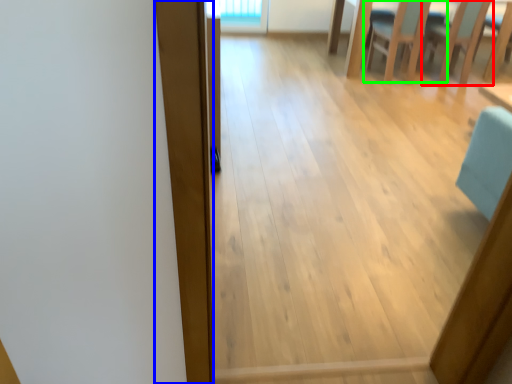
Question: Based on their relative distances, which object is farther from armchair (highlighted by a red box)? Choose from plank (highlighted by a blue box) and chair (highlighted by a green box).

Choices:
 (A) plank
 (B) chair

Answer: (A)